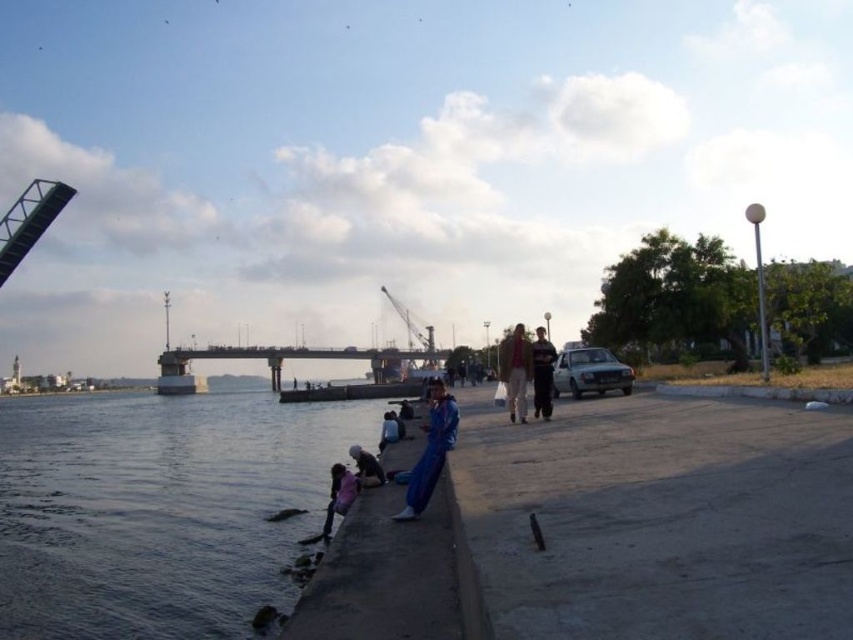
Question: Which object appears farthest from the camera in this image?

Choices:
 (A) concrete gray bridge at center
 (B) light brown leather jacket at center

Answer: (A)

Question: Based on their relative distances, which object is farther from the dark blue fabric at lower center?

Choices:
 (A) pink fabric child at lower left
 (B) dark gray concrete river at lower left
 (C) blue fabric pants at lower center

Answer: (B)

Question: Among these objects, which one is nearest to the camera?

Choices:
 (A) light blue fabric at lower center
 (B) light brown leather jacket at center
 (C) dark gray concrete river at lower left

Answer: (C)

Question: Can you confirm if dark blue fabric jacket at center is positioned above light blue fabric at lower center?

Choices:
 (A) no
 (B) yes

Answer: (B)

Question: Can you confirm if blue fabric pants at lower center is wider than light blue fabric at lower center?

Choices:
 (A) yes
 (B) no

Answer: (B)

Question: Does pink fabric child at lower left appear on the right side of light blue fabric at lower center?

Choices:
 (A) yes
 (B) no

Answer: (B)